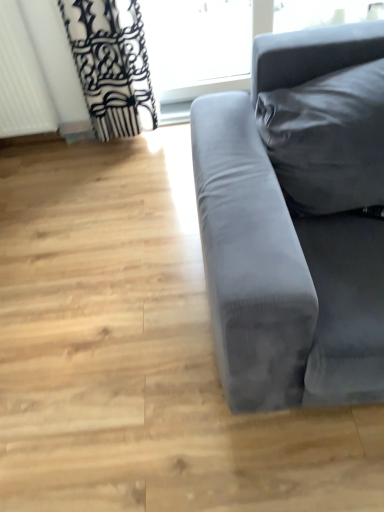
I want to click on velvet gray couch at right, so pyautogui.click(x=286, y=247).

You are a GUI agent. You are given a task and a screenshot of the screen. Output one action in this format:
    pyautogui.click(x=<x>, y=<y>)
    Task: Click on the white textured radiator at left
    
    Given the screenshot: What is the action you would take?
    pyautogui.click(x=21, y=80)

The image size is (384, 512). Describe the element at coordinates (197, 49) in the screenshot. I see `transparent glass window at upper center` at that location.

The width and height of the screenshot is (384, 512). Identify the location of velvet gray couch at right. (286, 247).

Is velvet gray couch at right positioned beyond the bounds of transparent glass window at upper center?

Yes, velvet gray couch at right is not within transparent glass window at upper center.

What's the angular difference between velvet gray couch at right and transparent glass window at upper center's facing directions?

There is a 0.000137-degree angle between the facing directions of velvet gray couch at right and transparent glass window at upper center.

Which object is positioned more to the right, velvet gray couch at right or transparent glass window at upper center?

transparent glass window at upper center.

Which is behind, point (214, 328) or point (340, 18)?

The point (340, 18) is more distant.

From the image's perspective, is velvet gray couch at right under white textured radiator at left?

Yes, from the image's perspective, velvet gray couch at right is beneath white textured radiator at left.

From a real-world perspective, which is physically above, velvet gray couch at right or white textured radiator at left?

white textured radiator at left is physically above.

Considering the positions of objects velvet gray couch at right and white textured radiator at left in the image provided, who is more to the right, velvet gray couch at right or white textured radiator at left?

velvet gray couch at right.

Looking at this image, is velvet gray couch at right positioned with its back to white textured radiator at left?

No, velvet gray couch at right's orientation is not away from white textured radiator at left.

From the image's perspective, which one is positioned lower, white textured radiator at left or transparent glass window at upper center?

white textured radiator at left.

Does white textured radiator at left have a smaller size compared to transparent glass window at upper center?

Yes.

Is white textured radiator at left taller or shorter than transparent glass window at upper center?

In the image, white textured radiator at left appears to be taller than transparent glass window at upper center.

Which is behind, point (7, 30) or point (193, 42)?

The point (193, 42) is behind.

From the image's perspective, is transparent glass window at upper center below velvet gray couch at right?

No.

Considering the relative positions of transparent glass window at upper center and velvet gray couch at right in the image provided, is transparent glass window at upper center to the left of velvet gray couch at right from the viewer's perspective?

No, transparent glass window at upper center is not to the left of velvet gray couch at right.

Can you confirm if transparent glass window at upper center is thinner than velvet gray couch at right?

Correct, the width of transparent glass window at upper center is less than that of velvet gray couch at right.

Does transparent glass window at upper center have a lesser height compared to white textured radiator at left?

Correct, transparent glass window at upper center is not as tall as white textured radiator at left.

Is transparent glass window at upper center with white textured radiator at left?

They are not placed beside each other.

Considering the relative sizes of transparent glass window at upper center and white textured radiator at left in the image provided, is transparent glass window at upper center thinner than white textured radiator at left?

Indeed, transparent glass window at upper center has a lesser width compared to white textured radiator at left.

From the image's perspective, is white textured radiator at left over velvet gray couch at right?

Indeed, from the image's perspective, white textured radiator at left is shown above velvet gray couch at right.

Which of these two, white textured radiator at left or velvet gray couch at right, is wider?

velvet gray couch at right.

This screenshot has width=384, height=512. I want to click on studio couch on the left side of transparent glass window at upper center, so click(x=286, y=247).

At what (x,y) coordinates should I click in order to perform the action: click on studio couch in front of the white textured radiator at left. Please return your answer as a coordinate pair (x, y). The width and height of the screenshot is (384, 512). Looking at the image, I should click on (286, 247).

From the image, which object appears to be farther from transparent glass window at upper center, velvet gray couch at right or white textured radiator at left?

velvet gray couch at right.

From the image, which object appears to be nearer to white textured radiator at left, transparent glass window at upper center or velvet gray couch at right?

Based on the image, transparent glass window at upper center appears to be nearer to white textured radiator at left.

Considering their positions, is velvet gray couch at right positioned closer to white textured radiator at left than transparent glass window at upper center?

transparent glass window at upper center lies closer to white textured radiator at left than the other object.

When comparing their distances from transparent glass window at upper center, does white textured radiator at left or velvet gray couch at right seem further?

velvet gray couch at right is further to transparent glass window at upper center.

From the image, which object appears to be farther from velvet gray couch at right, white textured radiator at left or transparent glass window at upper center?

Among the two, transparent glass window at upper center is located further to velvet gray couch at right.

From the image, which object appears to be farther from velvet gray couch at right, transparent glass window at upper center or white textured radiator at left?

transparent glass window at upper center is positioned further to the anchor velvet gray couch at right.

The image size is (384, 512). Identify the location of radiator between velvet gray couch at right and transparent glass window at upper center from front to back. (21, 80).